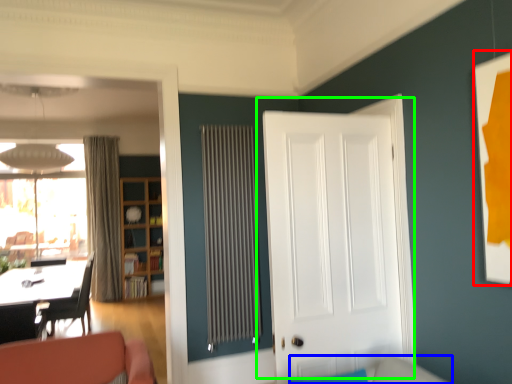
Question: Estimate the real-world distances between objects in this image. Which object is farther from picture frame (highlighted by a red box), couch (highlighted by a blue box) or door (highlighted by a green box)?

Choices:
 (A) couch
 (B) door

Answer: (A)